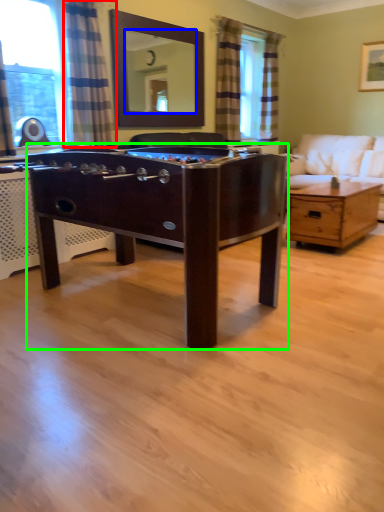
Question: Estimate the real-world distances between objects in this image. Which object is closer to curtain (highlighted by a red box), mirror (highlighted by a blue box) or desk (highlighted by a green box)?

Choices:
 (A) mirror
 (B) desk

Answer: (B)